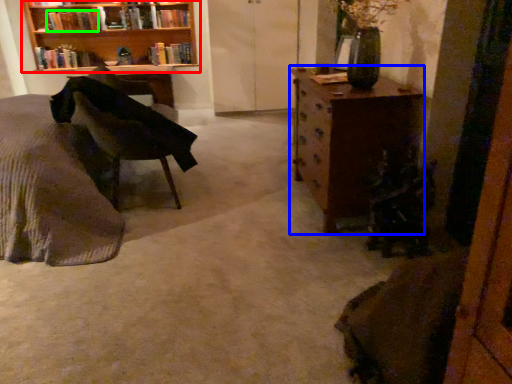
Question: Estimate the real-world distances between objects in this image. Which object is closer to bookcase (highlighted by a red box), chest of drawers (highlighted by a blue box) or book (highlighted by a green box)?

Choices:
 (A) chest of drawers
 (B) book

Answer: (B)